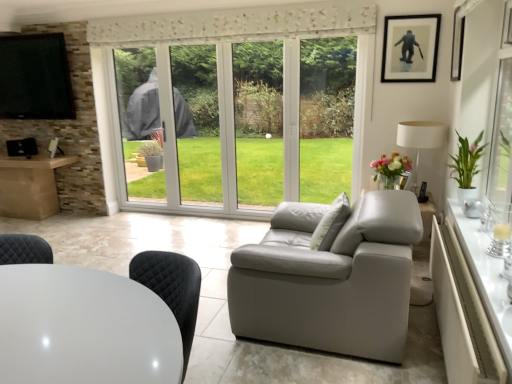
Question: From the image's perspective, is white glossy table at lower left, the 1th table viewed from the left, above or below white textured pillow at center?

Choices:
 (A) below
 (B) above

Answer: (A)

Question: From a real-world perspective, is white glossy table at lower left, which is counted as the second table, starting from the right, positioned above or below white textured pillow at center?

Choices:
 (A) above
 (B) below

Answer: (B)

Question: Estimate the real-world distances between objects in this image. Which object is farther from the white glossy table at lower left, which is counted as the second table, starting from the right?

Choices:
 (A) black glossy tv at upper left
 (B) black matte picture frame at upper right, which appears as the second picture frame when viewed from the front
 (C) white fabric lampshade at right
 (D) white textured pillow at center
 (E) black glossy picture frame at upper right, the 2th picture frame from the back

Answer: (A)

Question: Which is farther from the white fabric lampshade at right?

Choices:
 (A) white glossy table at lower left, the 1th table viewed from the left
 (B) black matte picture frame at upper right, positioned as the 1th picture frame in back-to-front order
 (C) white glossy table at right, the first table from the right
 (D) black glossy tv at upper left
 (E) white textured pillow at center

Answer: (D)